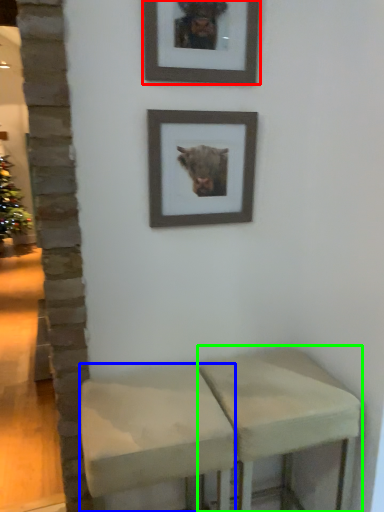
Question: Based on their relative distances, which object is farther from picture frame (highlighted by a red box)? Choose from stool (highlighted by a blue box) and stool (highlighted by a green box).

Choices:
 (A) stool
 (B) stool

Answer: (B)